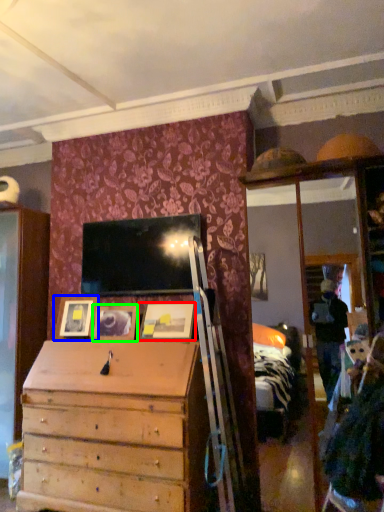
Question: Which is nearer to the picture frame (highlighted by a red box)? picture frame (highlighted by a blue box) or picture frame (highlighted by a green box).

Choices:
 (A) picture frame
 (B) picture frame

Answer: (B)